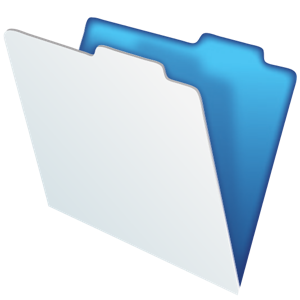
Identify the location of edge of back side of folder. The width and height of the screenshot is (300, 300). (100, 18), (233, 40), (281, 66), (272, 163).